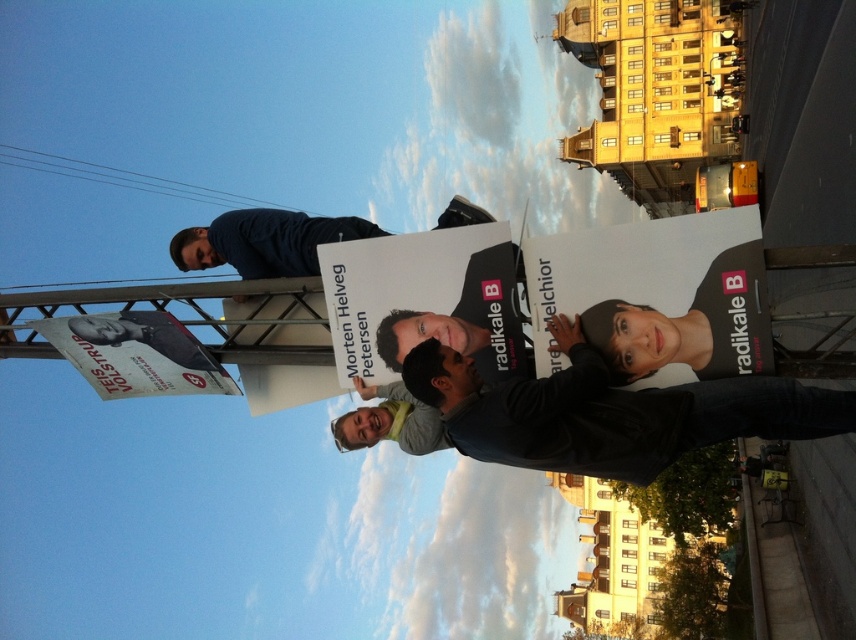
Which is above, matte black poster at center or matte black poster at upper left?

matte black poster at center is above.

Can you confirm if matte black poster at center is positioned to the right of matte black poster at upper left?

Indeed, matte black poster at center is positioned on the right side of matte black poster at upper left.

Which is in front, point (563, 280) or point (165, 344)?

Positioned in front is point (563, 280).

Where is `matte black poster at center`? matte black poster at center is located at coordinates (658, 296).

Is point (623, 310) behind point (502, 291)?

No, (623, 310) is in front of (502, 291).

At what (x,y) coordinates should I click in order to perform the action: click on matte black poster at center. Please return your answer as a coordinate pair (x, y). Looking at the image, I should click on (658, 296).

Looking at this image, is white paper poster at left smaller than matte black poster at upper left?

No.

Is white paper poster at left thinner than matte black poster at upper left?

No.

Image resolution: width=856 pixels, height=640 pixels. Describe the element at coordinates (135, 355) in the screenshot. I see `white paper poster at left` at that location.

Identify the location of white paper poster at left. This screenshot has height=640, width=856. (135, 355).